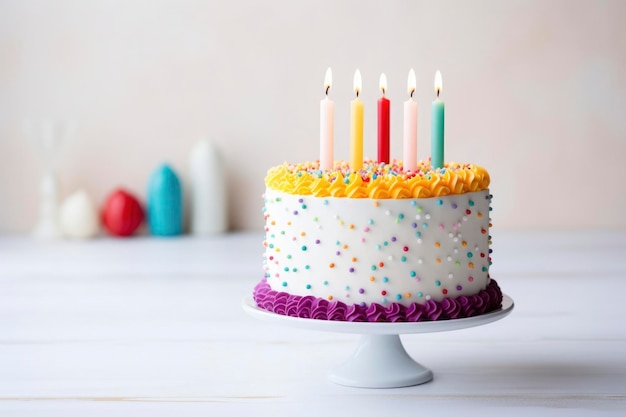
Image resolution: width=626 pixels, height=417 pixels. I want to click on candle flame, so click(332, 80), click(356, 82), click(382, 88), click(409, 84), click(439, 84).